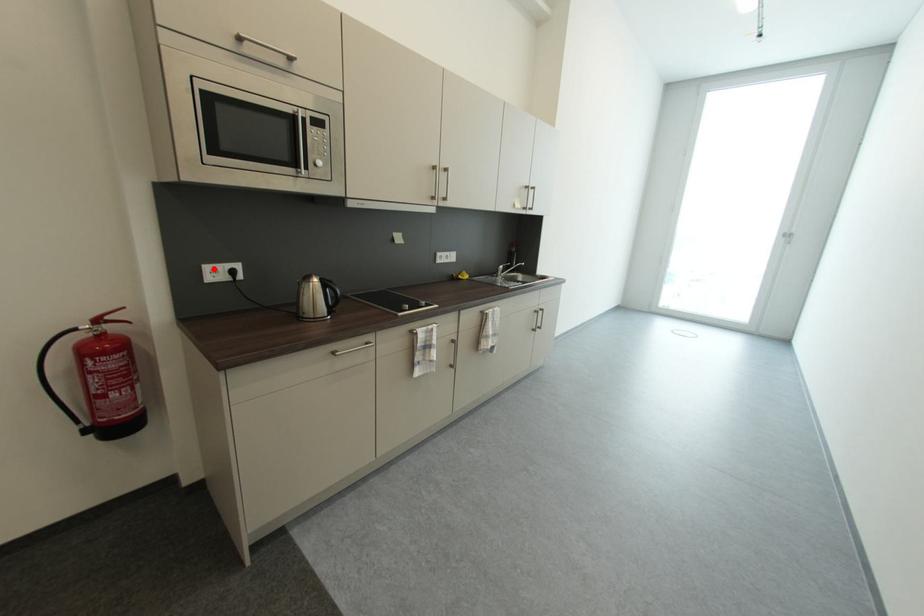
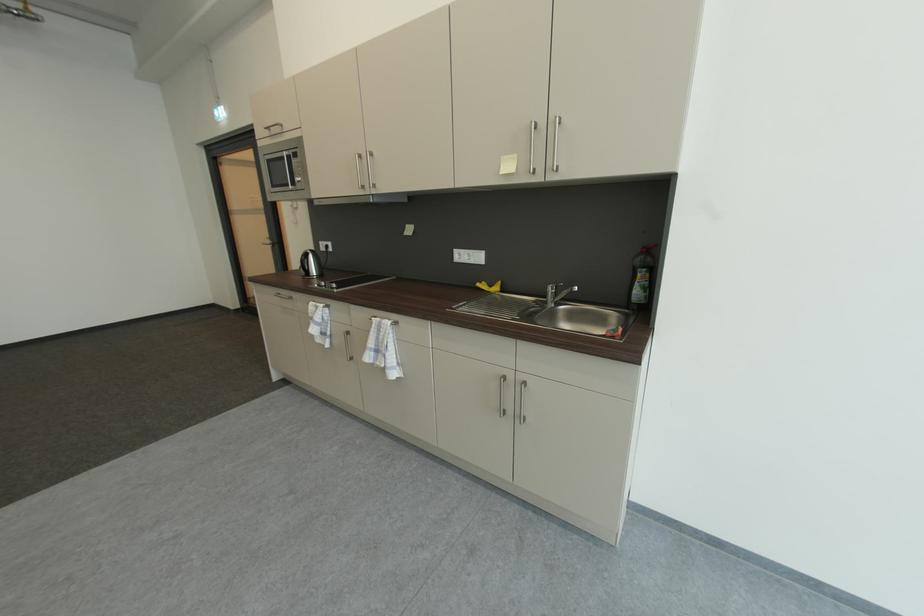
The point at the highlighted location is marked in the first image. Where is the corresponding point in the second image?

(327, 245)